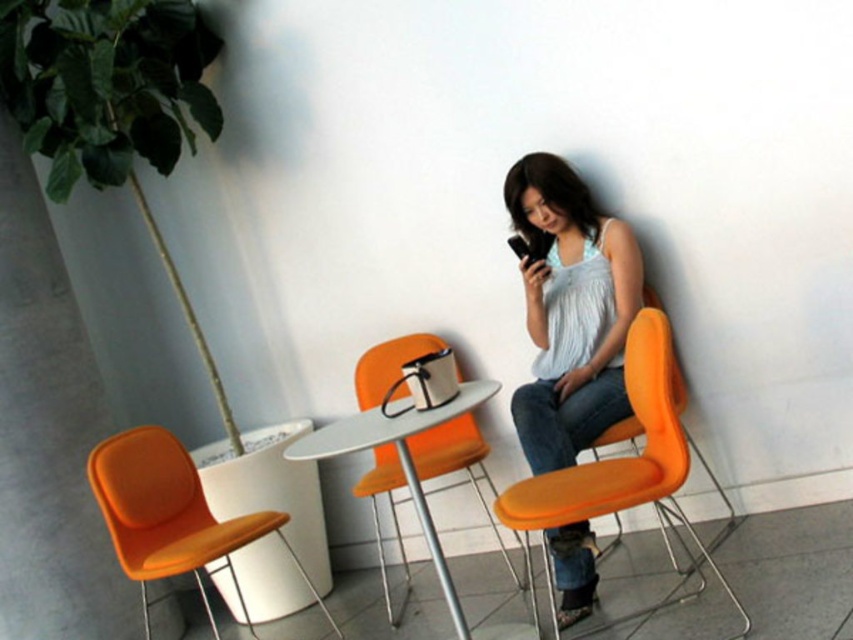
You are standing in the room and want to locate the matte white tank top at center. According to the coordinates provided, where would you find it?

The matte white tank top at center is located at the coordinates point (570, 310).

You are a fashion designer observing the scene. You notice the matte white tank top at center and the orange fabric chair at right. Which item has a greater height?

The matte white tank top at center is much taller than the orange fabric chair at right.

You are a fashion designer observing the scene. You notice the matte white tank top at center and the orange fabric chair at left. Which item is taller?

The matte white tank top at center is much taller than the orange fabric chair at left.